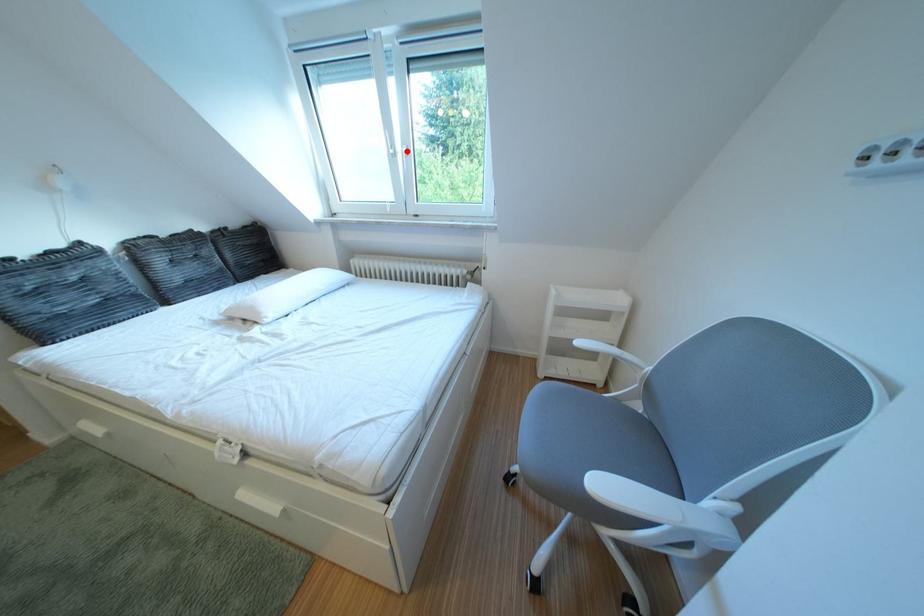
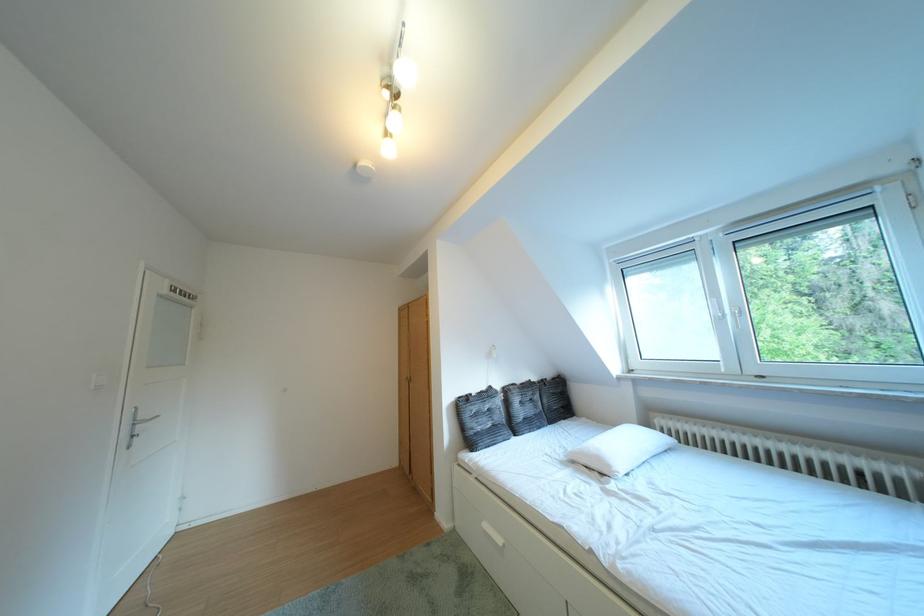
Locate, in the second image, the point that corresponds to the highlighted location in the first image.

(736, 315)